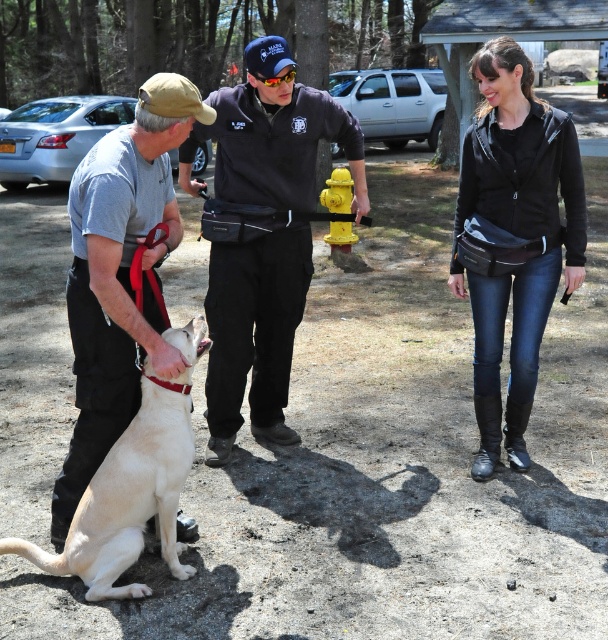
Does black leather jacket at center come behind yellow painted metal fire hydrant at center?

No, it is not.

Consider the image. Which of these two, black leather jacket at center or yellow painted metal fire hydrant at center, stands taller?

black leather jacket at center is taller.

Which is behind, point (513, 308) or point (342, 225)?

The point (342, 225) is behind.

Image resolution: width=608 pixels, height=640 pixels. In order to click on black leather jacket at center in this screenshot , I will do `click(513, 237)`.

Who is shorter, black leather jacket at center or light beige fabric dog at left?

With less height is light beige fabric dog at left.

Is point (480, 145) in front of point (85, 234)?

No, it is behind (85, 234).

Locate an element on the screen. black leather jacket at center is located at coordinates (513, 237).

Describe the element at coordinates (513, 237) in the screenshot. The width and height of the screenshot is (608, 640). I see `black leather jacket at center` at that location.

Locate an element on the screen. This screenshot has height=640, width=608. black leather jacket at center is located at coordinates (513, 237).

This screenshot has height=640, width=608. Find the location of `black leather jacket at center`. black leather jacket at center is located at coordinates (513, 237).